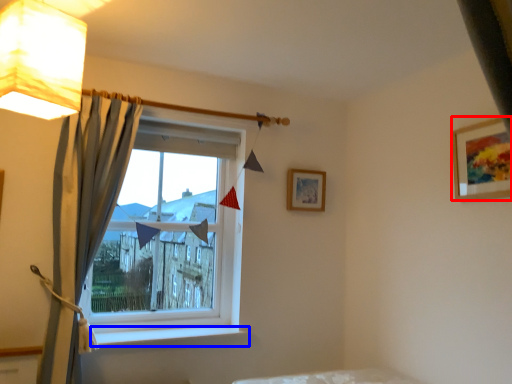
Question: Which object appears closest to the camera in this image, picture frame (highlighted by a red box) or window sill (highlighted by a blue box)?

Choices:
 (A) picture frame
 (B) window sill

Answer: (A)